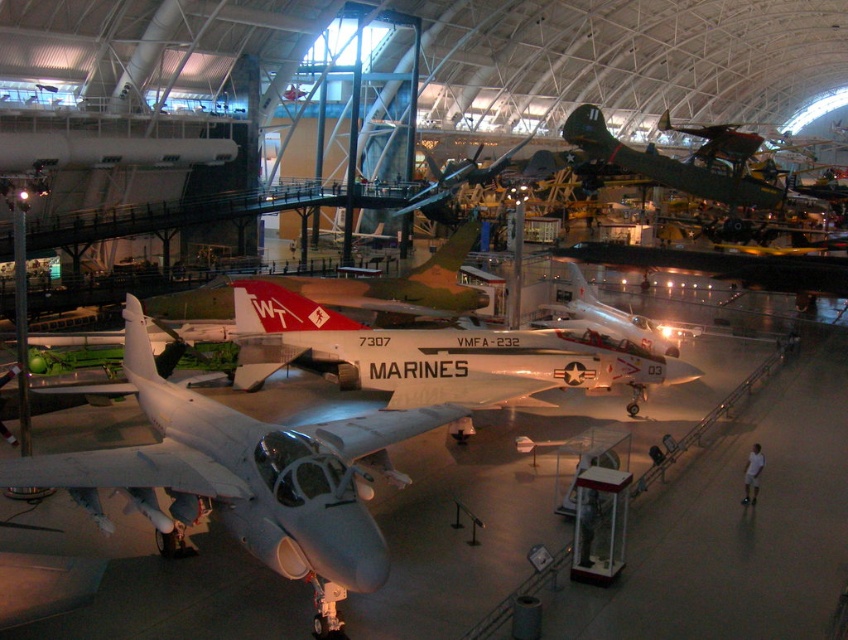
You are a museum visitor who wants to take a photo of both the matte gray jet at center and the green matte airplane at upper right. Which one should you stand closer to in order to capture both in a single frame without zooming?

Since the matte gray jet at center is narrower than the green matte airplane at upper right, you should stand closer to the matte gray jet at center to include both in the frame without zooming.

You are a visitor in the aviation museum. You see a point marked at coordinate [244,476]. What object is located at that point?

The point at coordinate [244,476] is occupied by a matte gray jet at center.

Looking at this image, you are standing at the entrance of the aviation museum and want to locate the matte gray jet at center. According to the coordinate system where the bottom left corner is the origin, what are its coordinates?

The matte gray jet at center is located at coordinates approximately 0.744 in the x direction and 0.289 in the y direction.